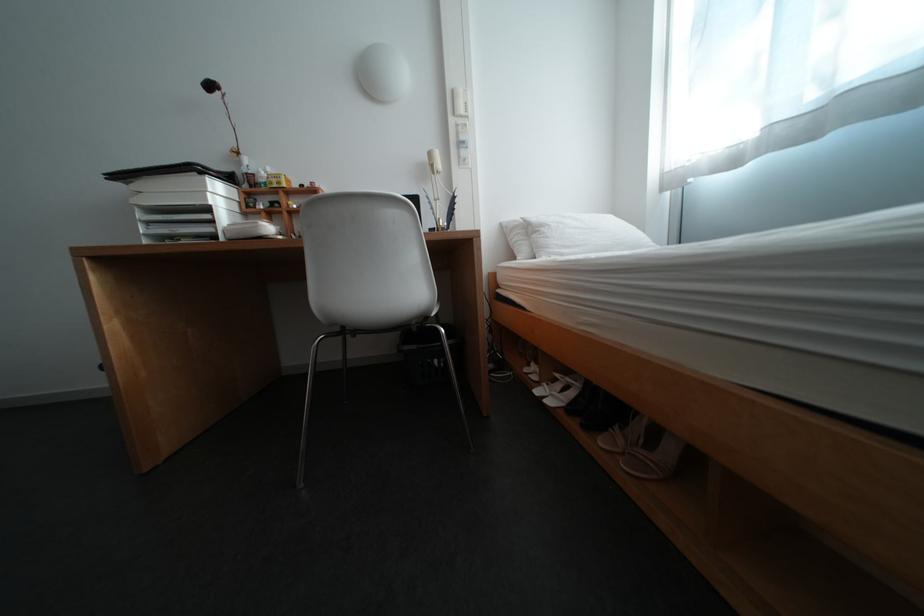
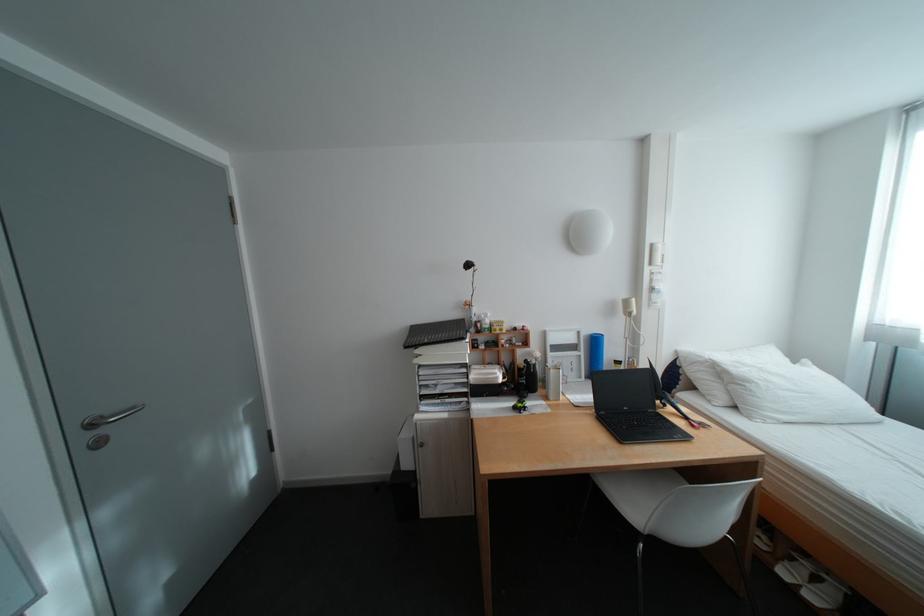
Find the pixel in the second image that matches point 293,238 in the first image.

(518, 381)